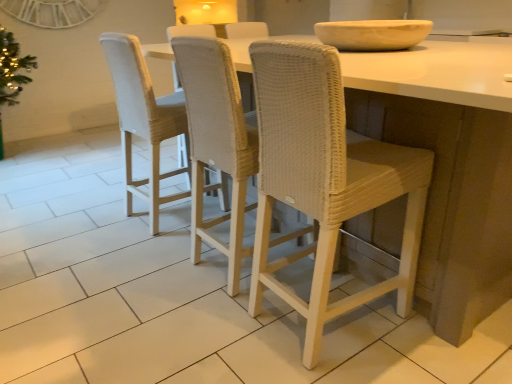
Question: Could you tell me if beige stone bowl at upper center is facing woven beige chair at center, the 3th chair viewed from the right?

Choices:
 (A) no
 (B) yes

Answer: (A)

Question: Is woven beige chair at center, the 3th chair viewed from the right, completely or partially inside beige stone bowl at upper center?

Choices:
 (A) yes
 (B) no

Answer: (B)

Question: Considering the relative sizes of beige stone bowl at upper center and woven beige chair at center, placed as the first chair when sorted from left to right, in the image provided, is beige stone bowl at upper center wider than woven beige chair at center, placed as the first chair when sorted from left to right,?

Choices:
 (A) no
 (B) yes

Answer: (B)

Question: From a real-world perspective, is beige stone bowl at upper center positioned over woven beige chair at center, placed as the first chair when sorted from left to right, based on gravity?

Choices:
 (A) no
 (B) yes

Answer: (B)

Question: From the image's perspective, is beige stone bowl at upper center under woven beige chair at center, the 3th chair viewed from the right?

Choices:
 (A) yes
 (B) no

Answer: (B)

Question: Is white woven stool at center taller or shorter than woven beige chair at center, which ranks as the 2th chair in left-to-right order?

Choices:
 (A) tall
 (B) short

Answer: (B)

Question: From the image's perspective, is white woven stool at center located above or below woven beige chair at center, marked as the second chair in a right-to-left arrangement?

Choices:
 (A) below
 (B) above

Answer: (B)

Question: Does point pyautogui.click(x=459, y=314) appear closer or farther from the camera than point pyautogui.click(x=237, y=104)?

Choices:
 (A) closer
 (B) farther

Answer: (A)

Question: From a real-world perspective, is white woven stool at center physically located above or below woven beige chair at center, which ranks as the 2th chair in left-to-right order?

Choices:
 (A) below
 (B) above

Answer: (A)

Question: From their relative heights in the image, would you say beige stone bowl at upper center is taller or shorter than woven beige chair at center, marked as the second chair in a right-to-left arrangement?

Choices:
 (A) tall
 (B) short

Answer: (B)

Question: Is beige stone bowl at upper center wider or thinner than woven beige chair at center, marked as the second chair in a right-to-left arrangement?

Choices:
 (A) thin
 (B) wide

Answer: (B)

Question: From a real-world perspective, is beige stone bowl at upper center positioned above or below woven beige chair at center, which ranks as the 2th chair in left-to-right order?

Choices:
 (A) below
 (B) above

Answer: (B)

Question: Is beige stone bowl at upper center in front of or behind woven beige chair at center, which ranks as the 2th chair in left-to-right order, in the image?

Choices:
 (A) behind
 (B) front

Answer: (A)

Question: Which is correct: woven beige chair at center, which ranks as the 2th chair in left-to-right order, is inside white wicker chair at center, which ranks as the 1th chair in right-to-left order, or outside of it?

Choices:
 (A) inside
 (B) outside

Answer: (B)

Question: Considering the positions of woven beige chair at center, which ranks as the 2th chair in left-to-right order, and white wicker chair at center, the third chair in the left-to-right sequence, in the image, is woven beige chair at center, which ranks as the 2th chair in left-to-right order, taller or shorter than white wicker chair at center, the third chair in the left-to-right sequence,?

Choices:
 (A) tall
 (B) short

Answer: (A)